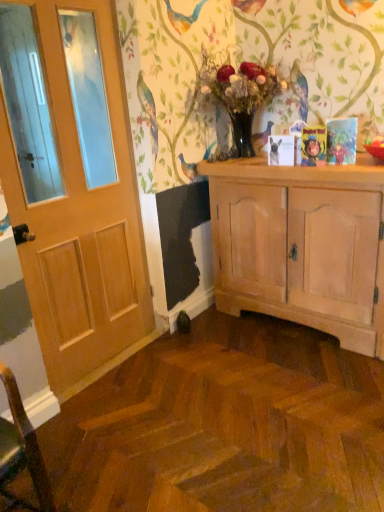
The image size is (384, 512). I want to click on vacant area on the back side of matte white dog at center, so click(259, 165).